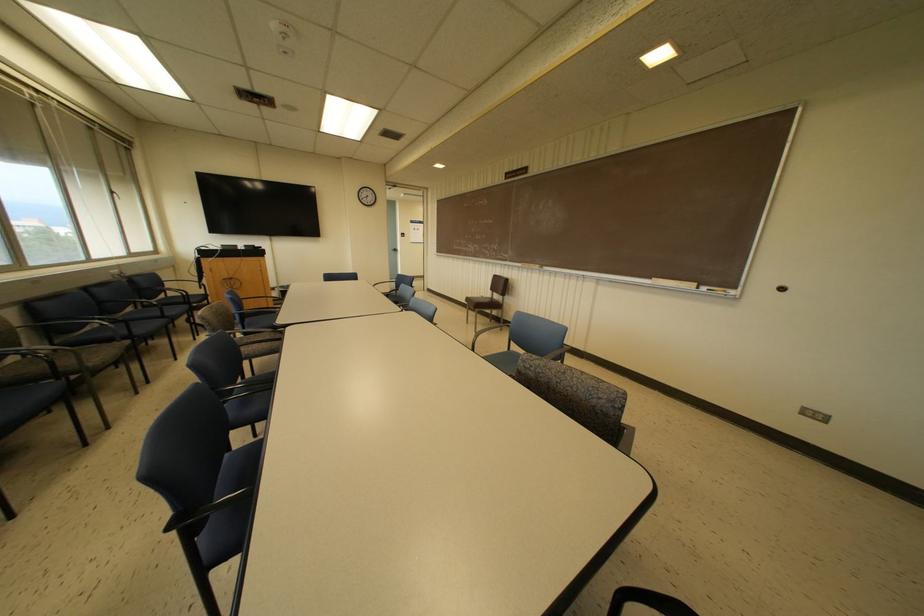
Which object does [674,283] point to?

It corresponds to the chalkboard eraser in the image.